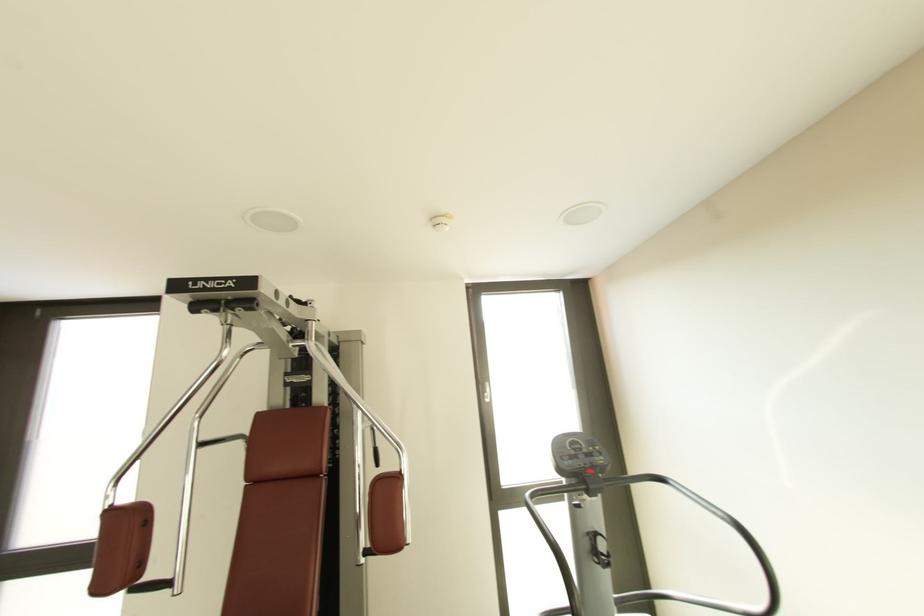
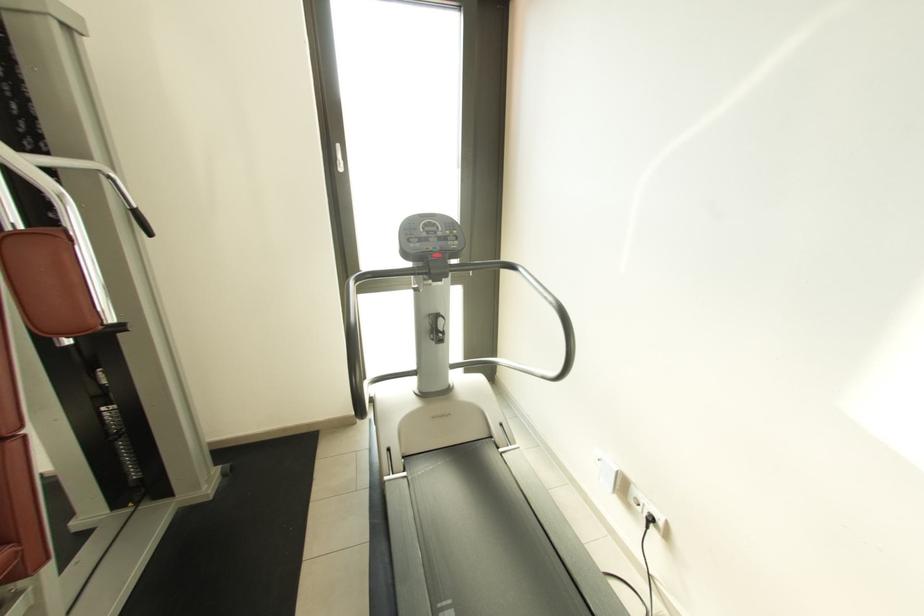
In the second image, find the point that corresponds to (x=492, y=400) in the first image.

(345, 171)